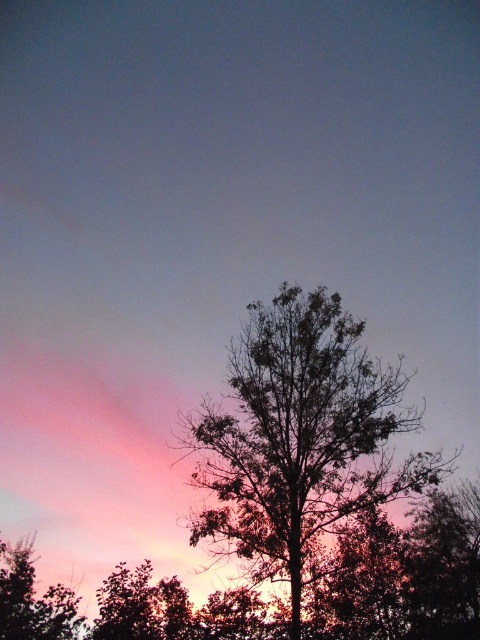
You are an artist trying to paint the sunset scene. You want to ensure the proportions between the silhouette leafy tree at center and the green leafy tree at lower left are accurate. Which tree should you draw wider?

The silhouette leafy tree at center should be drawn wider because its width is larger than the green leafy tree at lower left.